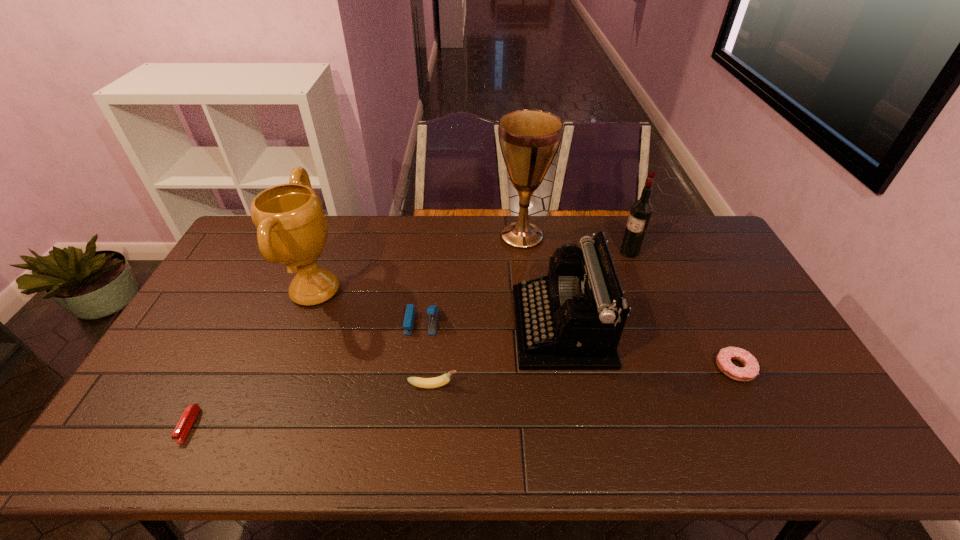
Where is `the left stapler`? the left stapler is located at coordinates (189, 415).

I want to click on free location located 0.100m on the front of the tallest object, so click(526, 272).

Where is `vacant space located 0.140m on the front of the award with the decoration`? The image size is (960, 540). vacant space located 0.140m on the front of the award with the decoration is located at coordinates (388, 291).

Locate an element on the screen. free space located 0.180m on the front and back of the sixth shortest object is located at coordinates (569, 252).

Locate an element on the screen. Image resolution: width=960 pixels, height=540 pixels. vacant space located on the front and back of the sixth shortest object is located at coordinates (583, 252).

I want to click on free region located 0.330m on the front and back of the sixth shortest object, so click(527, 252).

You are a GUI agent. You are given a task and a screenshot of the screen. Output one action in this format:
    pyautogui.click(x=<x>, y=<y>)
    Task: Click on the vacant space located on the typing side of the fifth shortest object
    This screenshot has width=960, height=540.
    Given the screenshot: What is the action you would take?
    pyautogui.click(x=458, y=326)

This screenshot has width=960, height=540. Find the location of `vacant region located 0.350m on the typing side of the fifth shortest object`. vacant region located 0.350m on the typing side of the fifth shortest object is located at coordinates (397, 326).

Find the location of a particular element. The width and height of the screenshot is (960, 540). free spot located on the typing side of the fifth shortest object is located at coordinates (397, 326).

This screenshot has width=960, height=540. What are the coordinates of `blank space located 0.230m on the back of the fourth shortest object` in the screenshot? It's located at (429, 261).